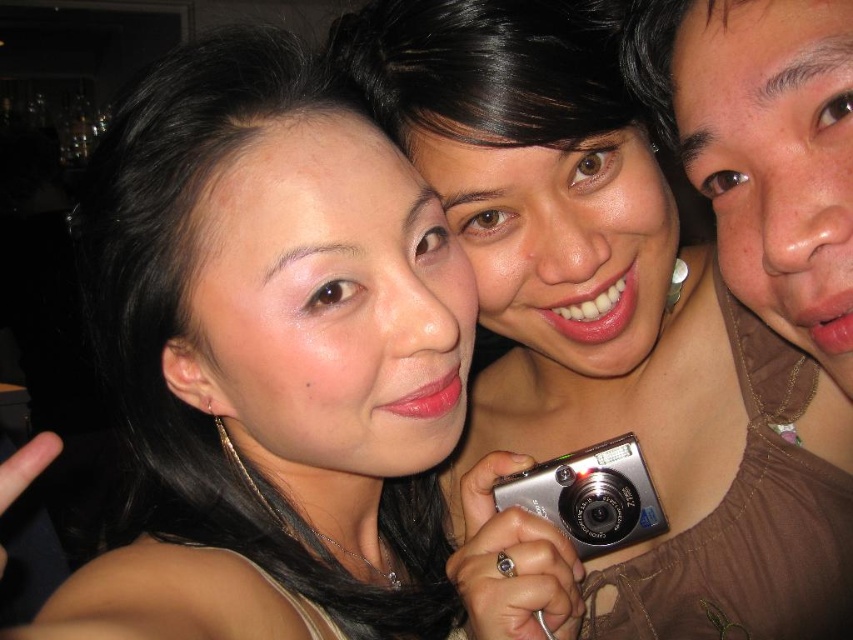
Is point (270, 381) farther from viewer compared to point (526, 472)?

That is False.

Is matte black hair at upper center above silver metallic camera at center?

Yes.

Where is `matte black hair at upper center`? The image size is (853, 640). matte black hair at upper center is located at coordinates (271, 355).

Is matte brown shirt at right bigger than silver metallic camera at center?

Indeed, matte brown shirt at right has a larger size compared to silver metallic camera at center.

Does point (848, 141) come in front of point (627, 451)?

That is True.

Who is more forward, [648,97] or [564,525]?

Point [648,97] is more forward.

Locate an element on the screen. Image resolution: width=853 pixels, height=640 pixels. matte brown shirt at right is located at coordinates (764, 150).

Is matte black hair at upper center bigger than matte brown shirt at right?

Yes, matte black hair at upper center is bigger than matte brown shirt at right.

Is matte black hair at upper center positioned at the back of matte brown shirt at right?

No, it is not.

Between point (247, 499) and point (775, 205), which one is positioned behind?

The point (247, 499) is behind.

The height and width of the screenshot is (640, 853). In order to click on matte black hair at upper center in this screenshot , I will do `click(271, 355)`.